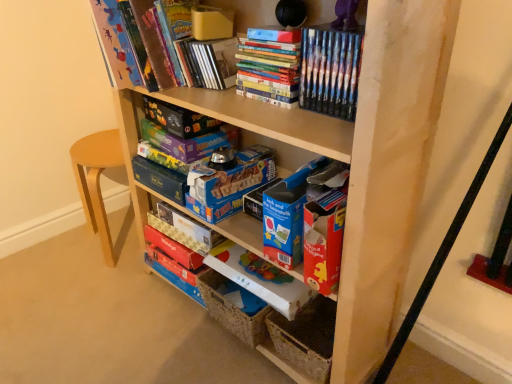
Question: Is matte cardboard book at center, the 2th paperback book in the bottom-to-top sequence, at the right side of blue cardboard storage box at lower center?

Choices:
 (A) yes
 (B) no

Answer: (B)

Question: From the image's perspective, is matte cardboard book at center, the 2th paperback book in the bottom-to-top sequence, located above blue cardboard storage box at lower center?

Choices:
 (A) yes
 (B) no

Answer: (A)

Question: Can you confirm if matte cardboard book at center, the 2th paperback book in the bottom-to-top sequence, is smaller than blue cardboard storage box at lower center?

Choices:
 (A) no
 (B) yes

Answer: (B)

Question: From a real-world perspective, is matte cardboard book at center, the 2th paperback book in the bottom-to-top sequence, beneath blue cardboard storage box at lower center?

Choices:
 (A) yes
 (B) no

Answer: (B)

Question: Could you tell me if matte cardboard book at center, the 2th paperback book in the bottom-to-top sequence, is facing blue cardboard storage box at lower center?

Choices:
 (A) yes
 (B) no

Answer: (B)

Question: Considering the positions of matte cardboard book at center, the 2th paperback book in the bottom-to-top sequence, and wooden shelf at center in the image, is matte cardboard book at center, the 2th paperback book in the bottom-to-top sequence, bigger or smaller than wooden shelf at center?

Choices:
 (A) big
 (B) small

Answer: (B)

Question: From the image's perspective, relative to wooden shelf at center, is matte cardboard book at center, the 2th paperback book in the bottom-to-top sequence, above or below?

Choices:
 (A) below
 (B) above

Answer: (A)

Question: Considering the positions of point (143, 236) and point (400, 122), is point (143, 236) closer or farther from the camera than point (400, 122)?

Choices:
 (A) closer
 (B) farther

Answer: (B)

Question: Considering their positions, is matte cardboard book at center, the sixth paperback book viewed from the top, located in front of or behind wooden shelf at center?

Choices:
 (A) behind
 (B) front

Answer: (A)

Question: Would you say matte board game at upper center, the 6th paperback book from the bottom, is to the left or to the right of hardcover book at upper center, the 7th paperback book positioned from the bottom, in the picture?

Choices:
 (A) left
 (B) right

Answer: (A)

Question: In terms of size, does matte board game at upper center, the 6th paperback book from the bottom, appear bigger or smaller than hardcover book at upper center, acting as the 1th paperback book starting from the top?

Choices:
 (A) small
 (B) big

Answer: (A)

Question: From the image's perspective, is matte board game at upper center, the 6th paperback book from the bottom, positioned above or below hardcover book at upper center, acting as the 1th paperback book starting from the top?

Choices:
 (A) above
 (B) below

Answer: (B)

Question: Considering their positions, is matte board game at upper center, acting as the second paperback book starting from the top, located in front of or behind hardcover book at upper center, the 7th paperback book positioned from the bottom?

Choices:
 (A) front
 (B) behind

Answer: (B)

Question: From the image's perspective, is hardcover books at upper center, which is the first book in right-to-left order, positioned above or below matte purple board game at center, positioned as the 5th paperback book in bottom-to-top order?

Choices:
 (A) above
 (B) below

Answer: (A)

Question: In terms of height, does hardcover books at upper center, which is the first book in right-to-left order, look taller or shorter compared to matte purple board game at center, positioned as the 5th paperback book in bottom-to-top order?

Choices:
 (A) tall
 (B) short

Answer: (A)